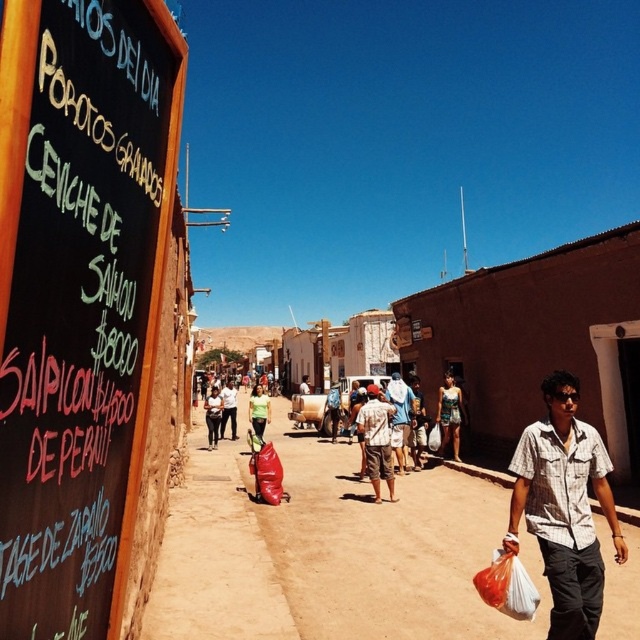
Question: From the image, what is the correct spatial relationship of plaid cotton shirt at lower right in relation to light brown fabric shirt at center?

Choices:
 (A) left
 (B) right

Answer: (B)

Question: Which object appears closest to the camera in this image?

Choices:
 (A) green fabric bag at center
 (B) black chalkboard at left
 (C) blue fabric shirt at center

Answer: (B)

Question: Does brown dirt alley at center have a smaller size compared to plaid cotton shirt at lower right?

Choices:
 (A) yes
 (B) no

Answer: (B)

Question: Is blue fabric shirt at center below green fabric bag at center?

Choices:
 (A) yes
 (B) no

Answer: (B)

Question: Which of the following is the farthest from the observer?

Choices:
 (A) blue fabric shirt at center
 (B) blue denim dress at center
 (C) black chalkboard at left

Answer: (B)

Question: Which point appears closest to the camera in this image?

Choices:
 (A) (220, 422)
 (B) (250, 408)
 (C) (54, 241)

Answer: (C)